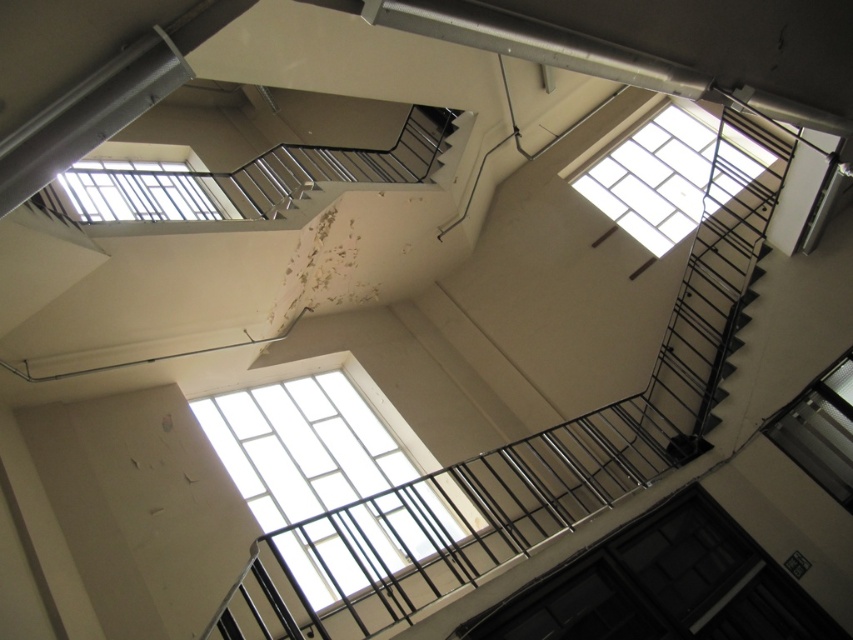
You are a window cleaner with a ladder that can reach up to 3 meters. You need to clean both the black metal fire escape at upper center and the clear glass window at center. Which object will require you to climb higher to reach?

The clear glass window at center requires climbing higher because it is larger than the black metal fire escape at upper center, which is smaller and positioned lower.